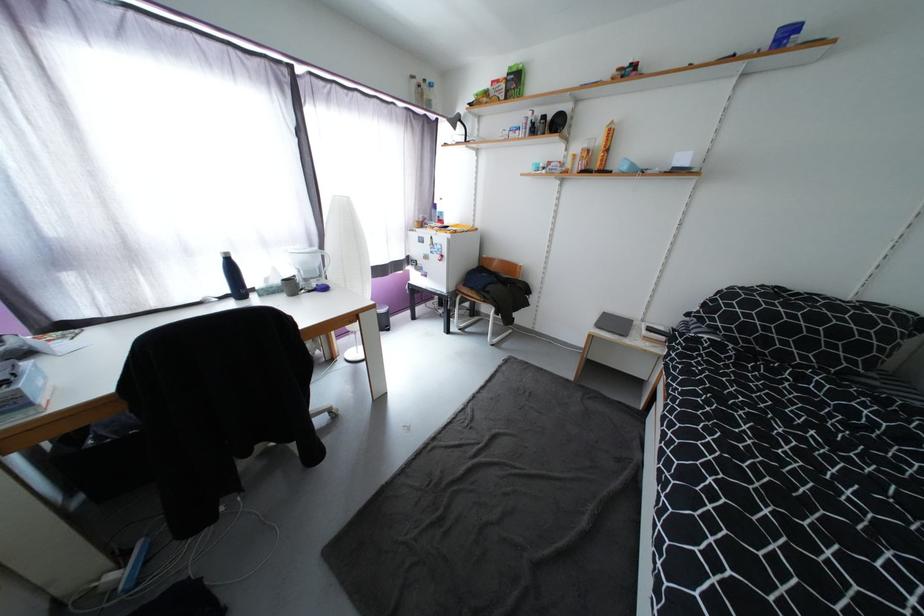
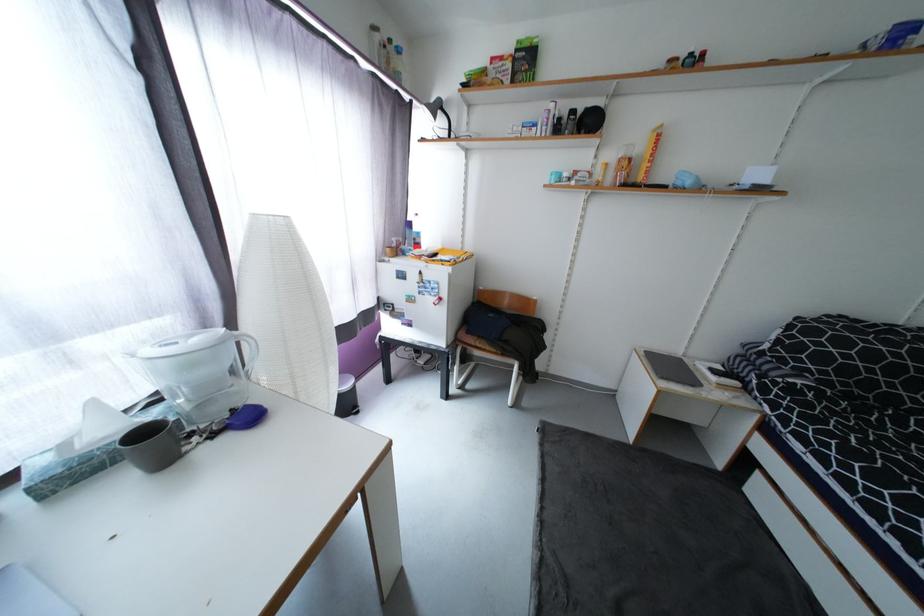
In the second image, find the point that corresponds to point (667, 339) in the first image.

(740, 385)